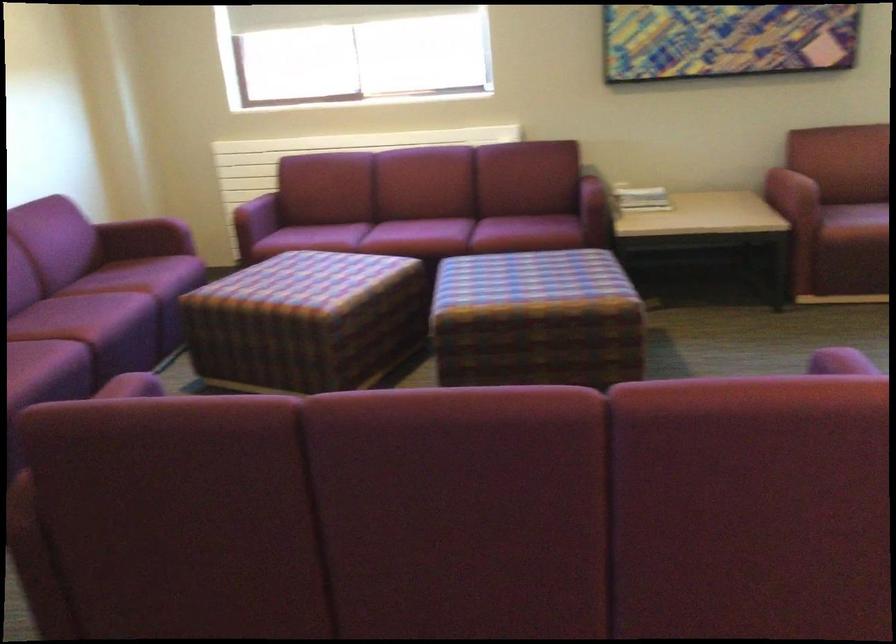
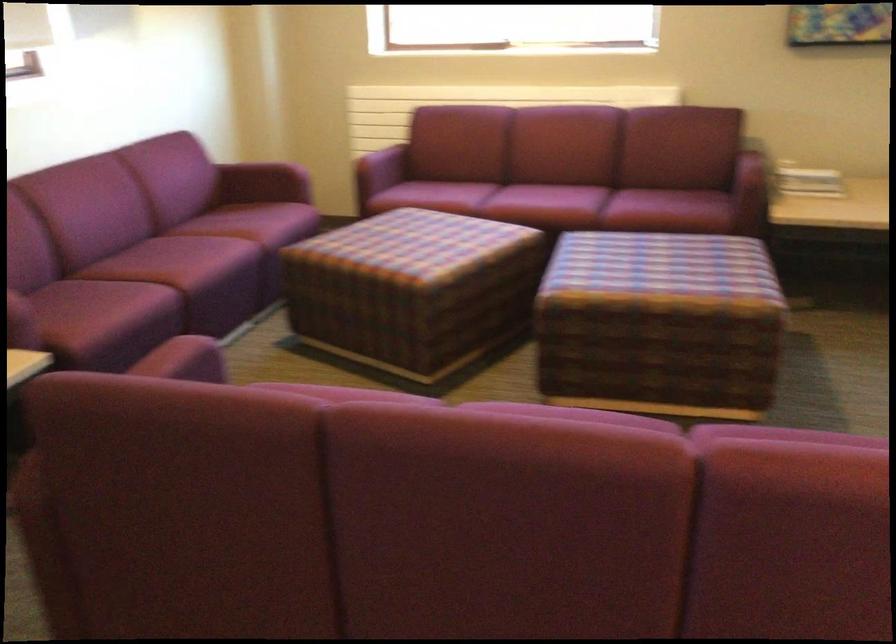
Where in the second image is the point corresponding to pixel 145 275 from the first image?

(254, 222)